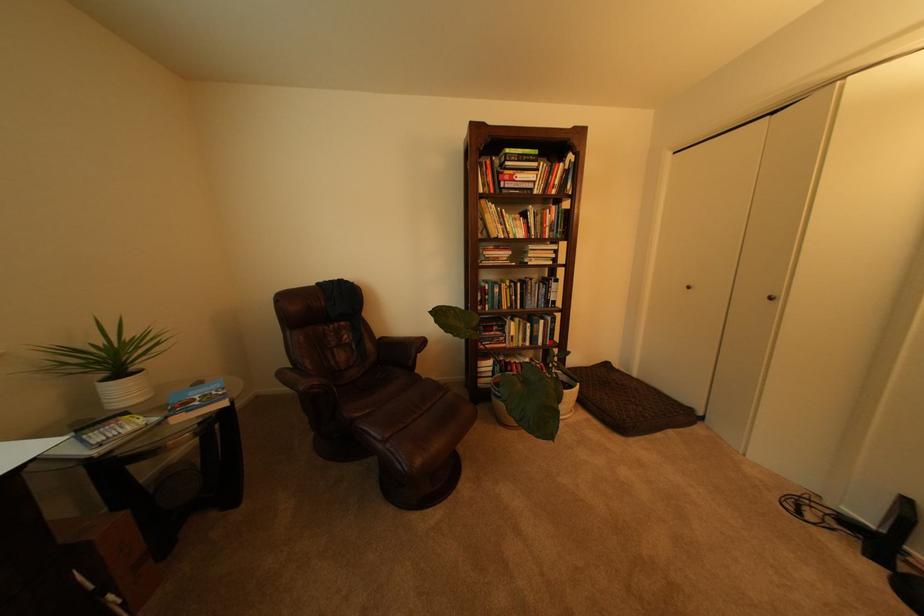
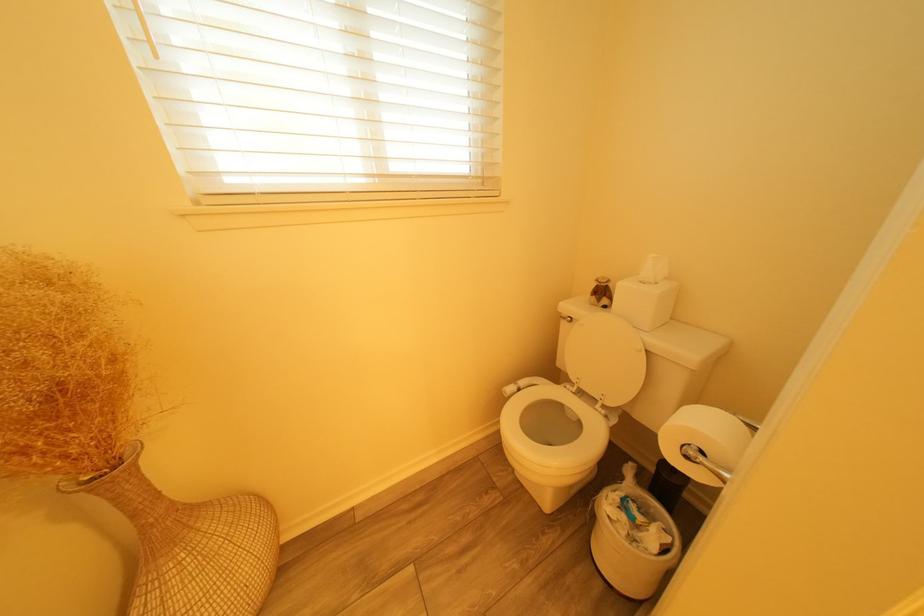
What movement of the cameraman would produce the second image?

The cameraman moved toward right, forward.